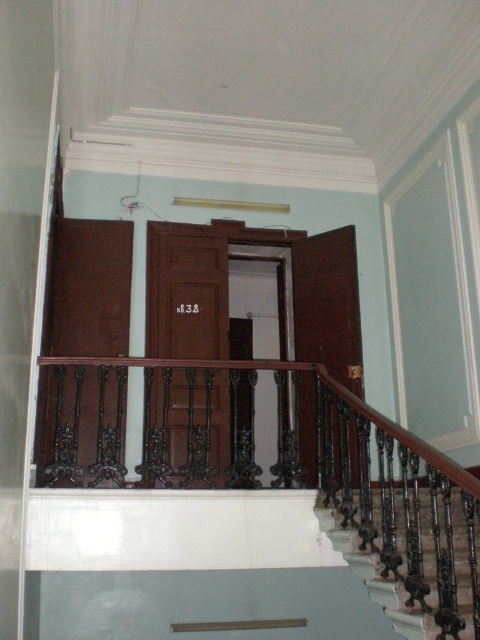
Question: Which point is closer to the camera taking this photo?

Choices:
 (A) pyautogui.click(x=349, y=547)
 (B) pyautogui.click(x=466, y=605)

Answer: (B)

Question: Can you confirm if black wrought iron railing at center is wider than dark brown wrought iron at lower right?

Choices:
 (A) no
 (B) yes

Answer: (B)

Question: Is black wrought iron railing at center thinner than dark brown wrought iron at lower right?

Choices:
 (A) no
 (B) yes

Answer: (A)

Question: Among these objects, which one is farthest from the camera?

Choices:
 (A) dark brown wrought iron at lower right
 (B) black wrought iron railing at center

Answer: (A)

Question: Which point is closer to the camera?

Choices:
 (A) (358, 528)
 (B) (326, 461)

Answer: (A)

Question: From the image, what is the correct spatial relationship of black wrought iron railing at center in relation to dark brown wrought iron at lower right?

Choices:
 (A) left
 (B) right

Answer: (A)